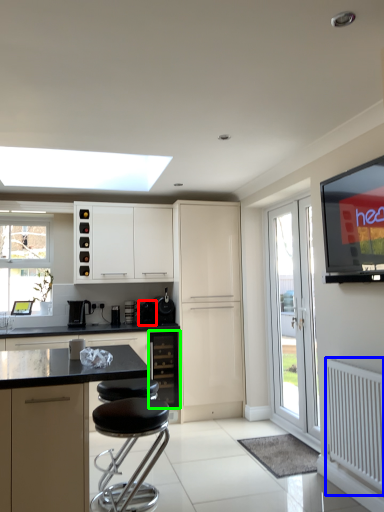
Question: Which object is positioned farthest from appliance (highlighted by a red box)? Select from radiator (highlighted by a blue box) and cabinetry (highlighted by a green box).

Choices:
 (A) radiator
 (B) cabinetry

Answer: (A)